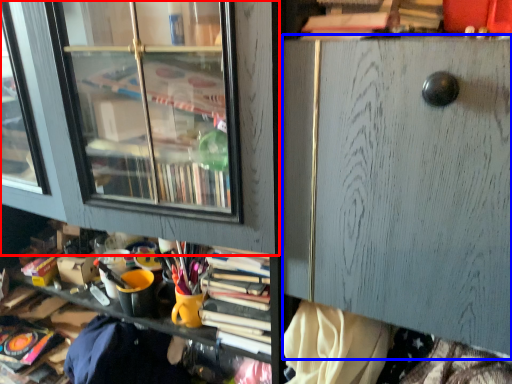
Question: Which object is further to the camera taking this photo, shelf (highlighted by a red box) or file cabinet (highlighted by a blue box)?

Choices:
 (A) shelf
 (B) file cabinet

Answer: (A)